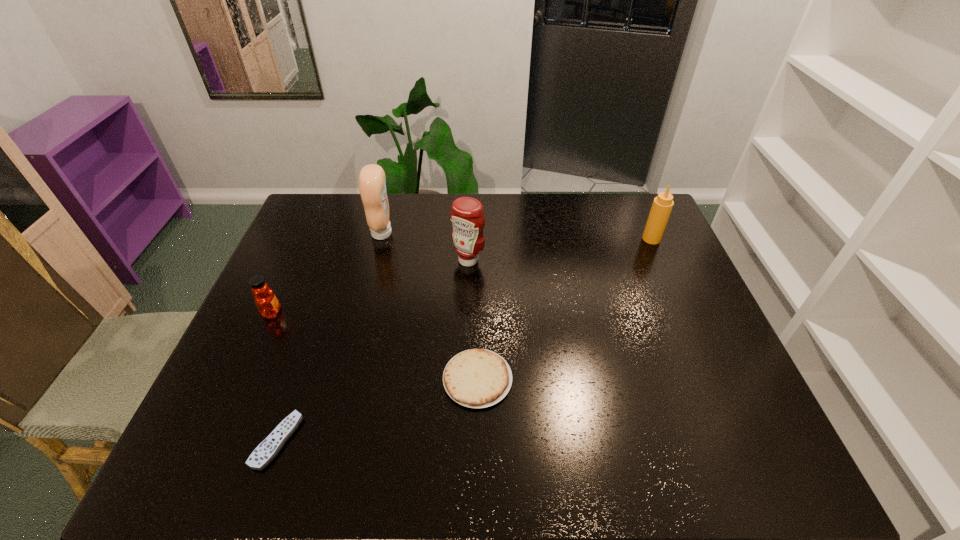
The height and width of the screenshot is (540, 960). I want to click on vacant space that satisfies the following two spatial constraints: 1. on the label of the leftmost condiment; 2. on the right side of the rightmost object, so click(381, 239).

The height and width of the screenshot is (540, 960). Find the location of `free spot that satisfies the following two spatial constraints: 1. on the label of the second shortest object; 2. on the right side of the fourth object from right to left`. free spot that satisfies the following two spatial constraints: 1. on the label of the second shortest object; 2. on the right side of the fourth object from right to left is located at coordinates (345, 379).

The height and width of the screenshot is (540, 960). Find the location of `vacant space that satisfies the following two spatial constraints: 1. on the front label of the remote control; 2. on the right side of the fourth farthest object`. vacant space that satisfies the following two spatial constraints: 1. on the front label of the remote control; 2. on the right side of the fourth farthest object is located at coordinates (215, 440).

I want to click on blank space that satisfies the following two spatial constraints: 1. on the front label of the fourth tallest object; 2. on the right side of the tortilla, so click(242, 379).

The image size is (960, 540). Find the location of `free region that satisfies the following two spatial constraints: 1. on the label of the leftmost condiment; 2. on the right side of the rightmost condiment`. free region that satisfies the following two spatial constraints: 1. on the label of the leftmost condiment; 2. on the right side of the rightmost condiment is located at coordinates [x=381, y=239].

At what (x,y) coordinates should I click in order to perform the action: click on vacant space that satisfies the following two spatial constraints: 1. on the back side of the tortilla; 2. on the label of the leftmost condiment. Please return your answer as a coordinate pair (x, y). The image size is (960, 540). Looking at the image, I should click on (478, 233).